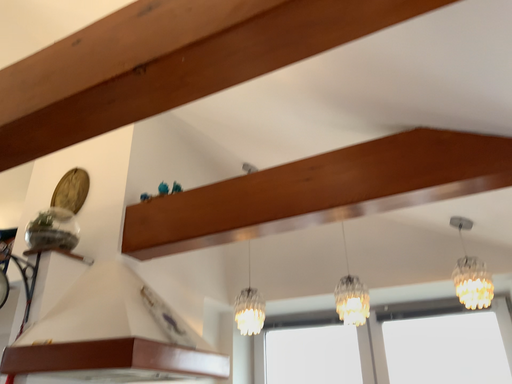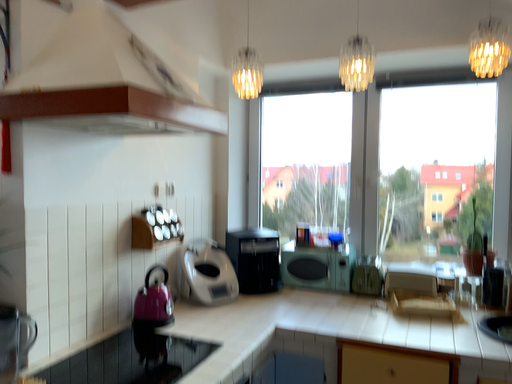
Question: How did the camera likely rotate when shooting the video?

Choices:
 (A) rotated upward
 (B) rotated downward

Answer: (B)